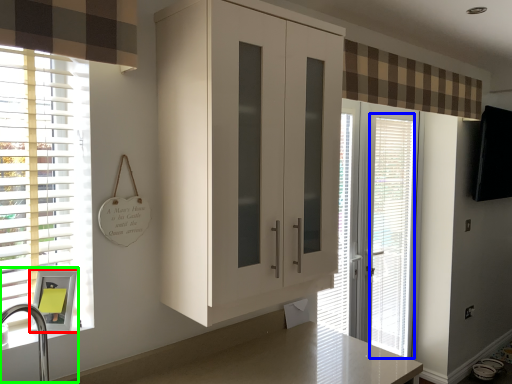
Question: Considering the real-world distances, which object is closest to medicine cabinet (highlighted by a red box)? blind (highlighted by a blue box) or sink (highlighted by a green box).

Choices:
 (A) blind
 (B) sink

Answer: (B)